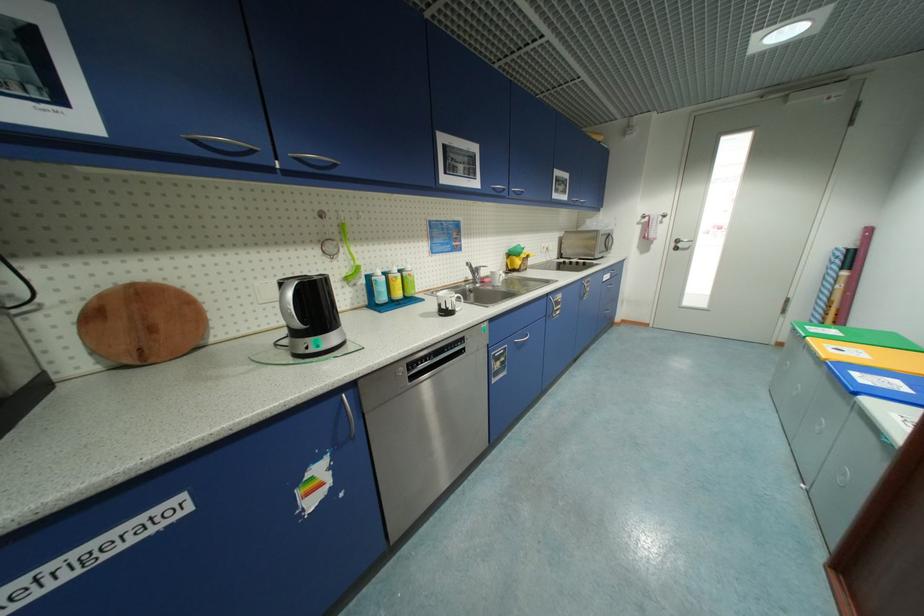
You are a GUI agent. You are given a task and a screenshot of the screen. Output one action in this format:
    pyautogui.click(x=<x>, y=<y>)
    Task: Click on the black mug handle
    Image resolution: width=924 pixels, height=616 pixels.
    Given the screenshot: What is the action you would take?
    pyautogui.click(x=458, y=300)